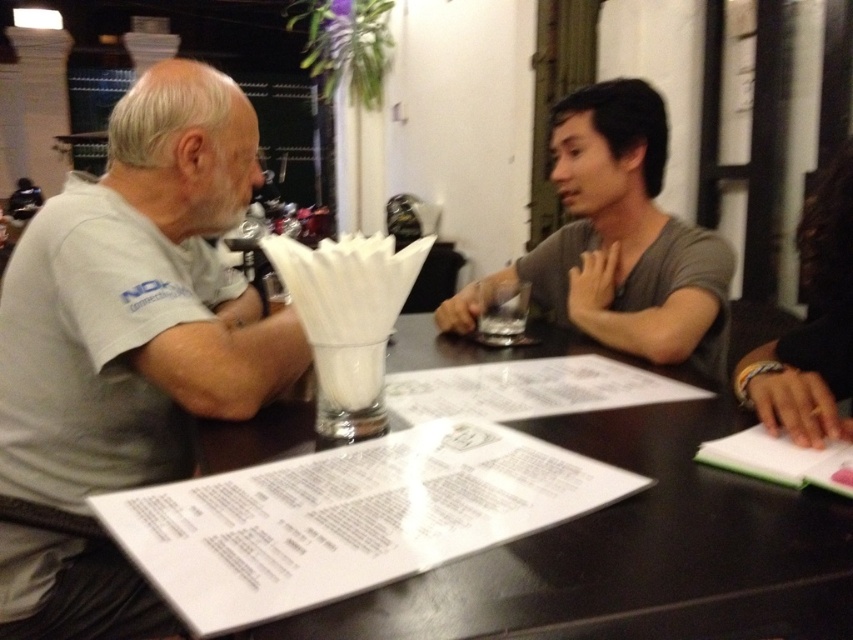
You are a server at the restaurant and need to place a new drink order between the black glossy table at center and the white paper menu at center. Which object should you place it closer to?

The black glossy table at center is located below the white paper menu at center, so you should place the drink closer to the black glossy table at center since it is underneath the menu.

You are a waiter in a restaurant. You need to place a 1.5 meter long tray on the table. Can you fit the tray on the black glossy table at center without overlapping the gray matte shirt at center?

The black glossy table at center might be wider than gray matte shirt at center, so there is a possibility that the tray can be placed without overlapping, but the exact dimensions are uncertain. Please check the table size before placing the tray.